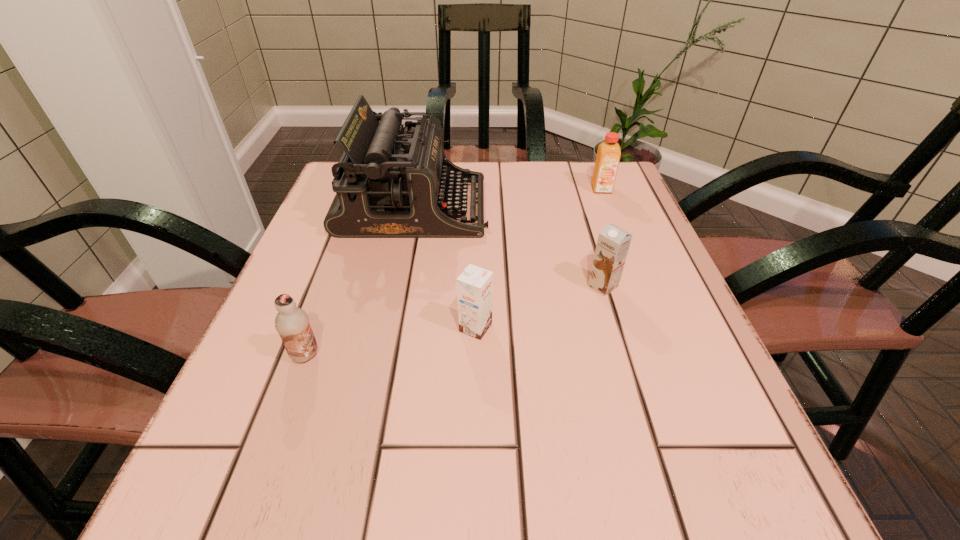
Identify the location of object that is positioned at the far right corner. pyautogui.click(x=608, y=155).

The height and width of the screenshot is (540, 960). I want to click on blank space at the far edge of the desktop, so click(556, 180).

Identify the location of free region at the near edge. The height and width of the screenshot is (540, 960). (484, 523).

This screenshot has height=540, width=960. I want to click on vacant space at the left edge of the desktop, so click(x=338, y=326).

Image resolution: width=960 pixels, height=540 pixels. Identify the location of vacant space at the right edge of the desktop. (637, 255).

This screenshot has width=960, height=540. In the image, there is a desktop. Find the location of `vacant space at the far right corner`. vacant space at the far right corner is located at coordinates (619, 168).

You are a GUI agent. You are given a task and a screenshot of the screen. Output one action in this format:
    pyautogui.click(x=<x>, y=<y>)
    Task: Click on the free space that is in between the nearest object and the orange juice
    
    Given the screenshot: What is the action you would take?
    pyautogui.click(x=453, y=272)

Locate an element on the screen. The height and width of the screenshot is (540, 960). free space between the tallest object and the second chocolate milk from left to right is located at coordinates (444, 267).

At what (x,y) coordinates should I click in order to perform the action: click on vacant space that's between the nearest chocolate milk and the tallest object. Please return your answer as a coordinate pair (x, y). This screenshot has width=960, height=540. Looking at the image, I should click on (360, 281).

Image resolution: width=960 pixels, height=540 pixels. What are the coordinates of `empty space that is in between the leftmost chocolate milk and the fourth farthest object` in the screenshot? It's located at (391, 341).